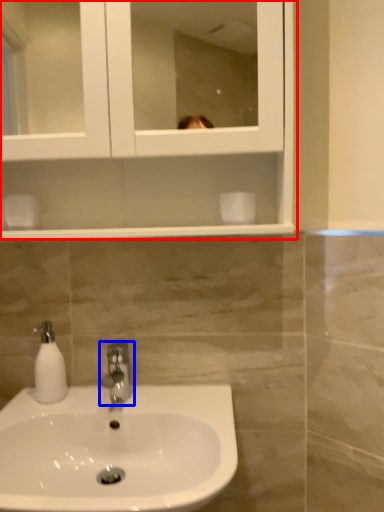
Question: Which object appears farthest to the camera in this image, medicine cabinet (highlighted by a red box) or tap (highlighted by a blue box)?

Choices:
 (A) medicine cabinet
 (B) tap

Answer: (B)